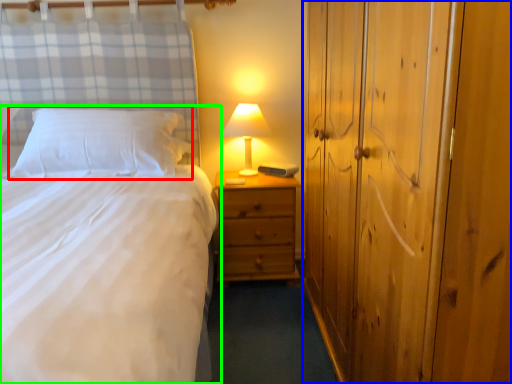
Question: Based on their relative distances, which object is farther from pillow (highlighted by a red box)? Choose from dresser (highlighted by a blue box) and bed (highlighted by a green box).

Choices:
 (A) dresser
 (B) bed

Answer: (A)